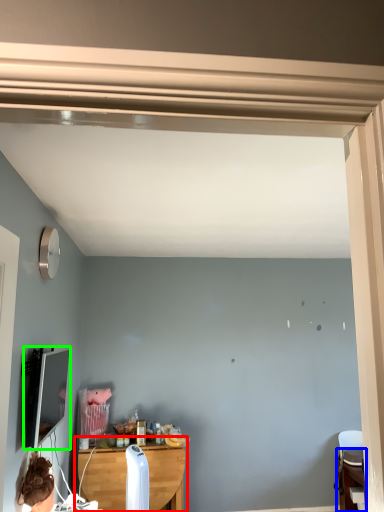
Question: Based on their relative distances, which object is farther from table (highlighted by a red box)? Choose from table (highlighted by a blue box) and computer monitor (highlighted by a green box).

Choices:
 (A) table
 (B) computer monitor

Answer: (A)